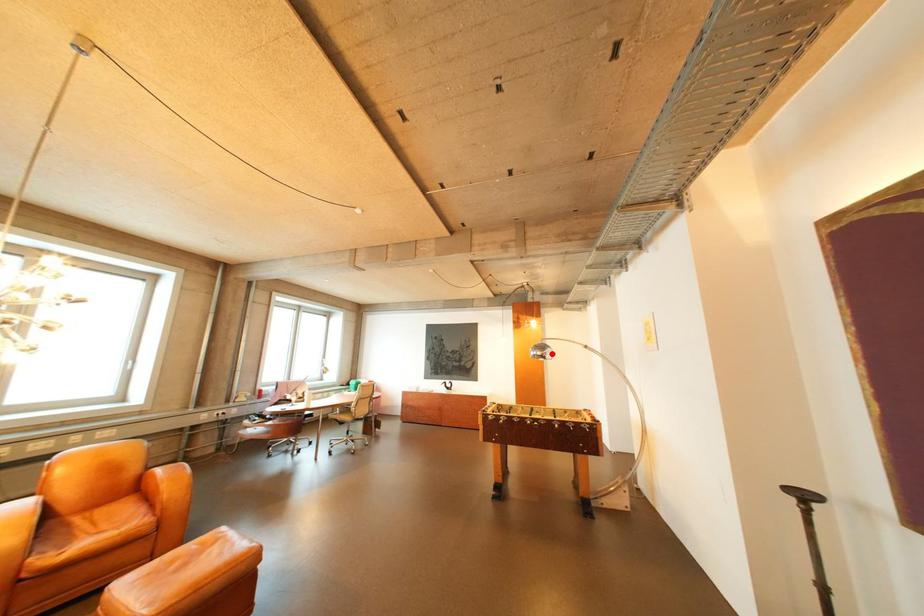
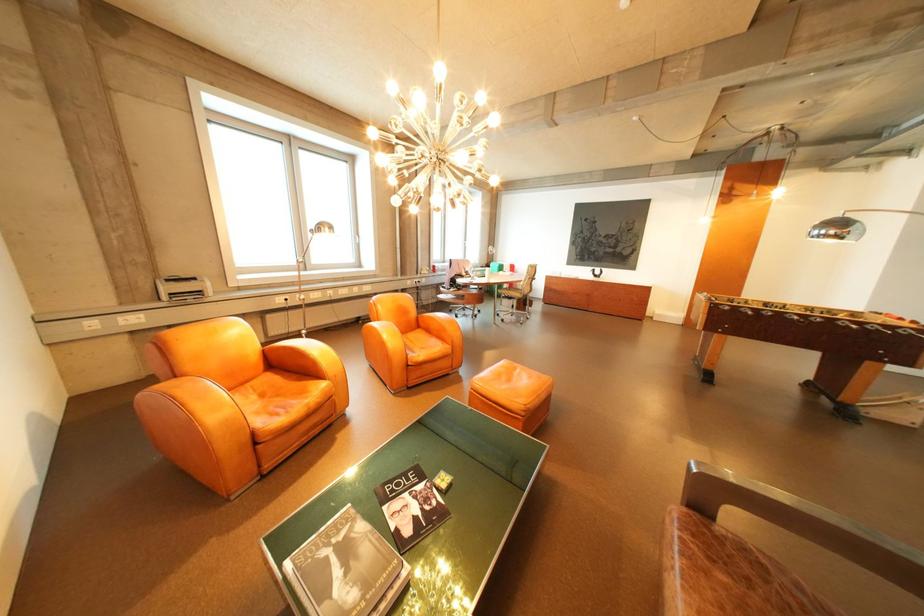
Locate, in the second image, the point that corresponds to the highlighted location in the first image.

(846, 233)